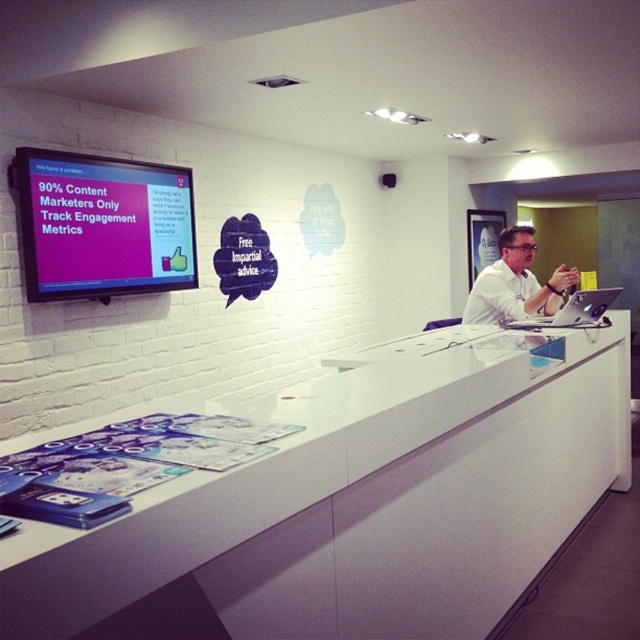
Does white glossy counter at center have a lesser height compared to white shirt at center?

No.

Is white glossy counter at center wider than white shirt at center?

Correct, the width of white glossy counter at center exceeds that of white shirt at center.

Identify the location of white glossy counter at center. (358, 499).

Find the location of `white glossy counter at center`. white glossy counter at center is located at coordinates (358, 499).